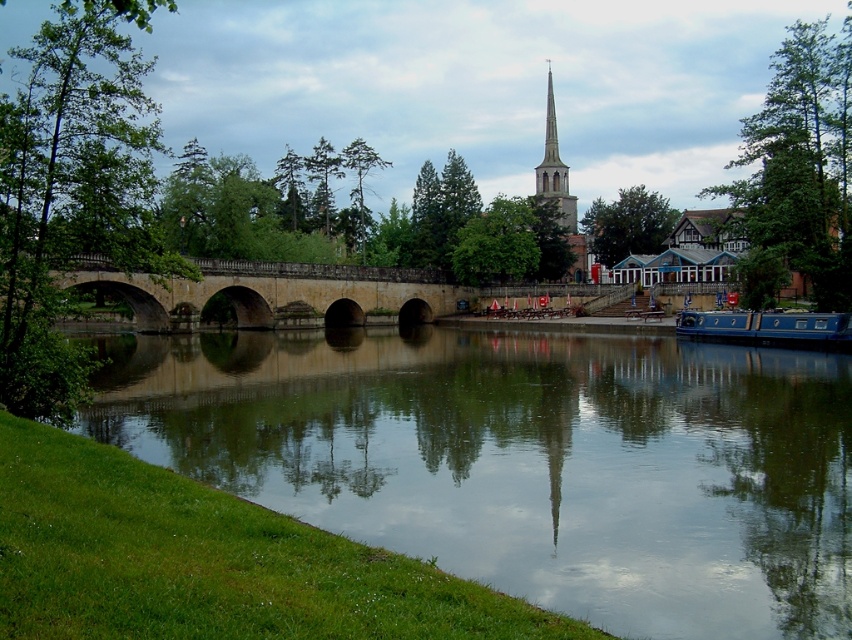
Question: Which of the following is the farthest from the observer?

Choices:
 (A) (550, 166)
 (B) (752, 324)
 (C) (490, 397)

Answer: (A)

Question: Does green grassy bank at lower left have a smaller size compared to stone bridge at center?

Choices:
 (A) no
 (B) yes

Answer: (A)

Question: Which of the following is the closest to the observer?

Choices:
 (A) blue polished wood boat at lower right
 (B) green grassy bank at lower left
 (C) smooth stone spire at upper center
 (D) stone bridge at center

Answer: (B)

Question: Which point appears farthest from the camera in this image?

Choices:
 (A) (x=458, y=570)
 (B) (x=722, y=333)

Answer: (B)

Question: Does blue polished wood boat at lower right appear under smooth stone spire at upper center?

Choices:
 (A) no
 (B) yes

Answer: (B)

Question: Is blue polished wood boat at lower right thinner than smooth stone spire at upper center?

Choices:
 (A) no
 (B) yes

Answer: (B)